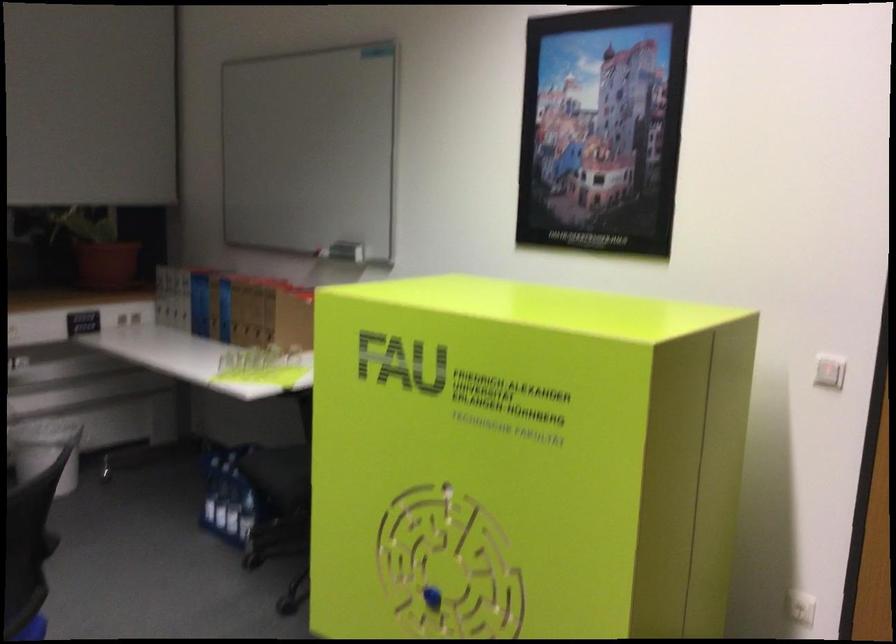
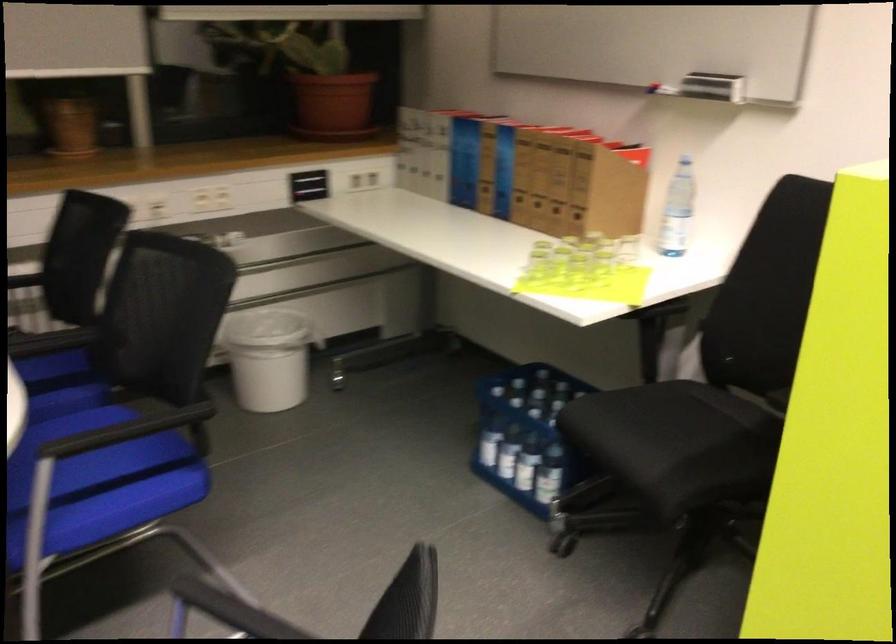
What movement of the cameraman would produce the second image?

The cameraman moved toward left, forward.